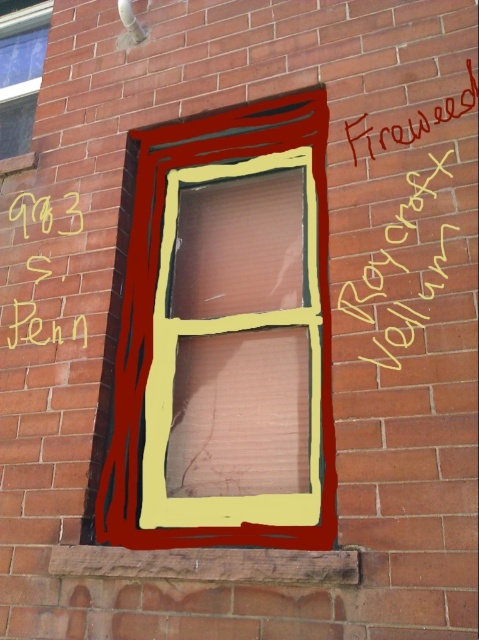
Question: Which object is closer to the camera taking this photo?

Choices:
 (A) yellow marker writing at center right
 (B) wooden window frame at center

Answer: (B)

Question: Is wooden window frame at center above yellow chalk writing at center?

Choices:
 (A) yes
 (B) no

Answer: (B)

Question: Which point is closer to the camera taking this photo?

Choices:
 (A) click(72, 321)
 (B) click(469, 64)
 (C) click(16, 115)

Answer: (B)

Question: Estimate the real-world distances between objects in this image. Which object is closer to the matte glass window at upper left?

Choices:
 (A) wooden window frame at center
 (B) yellow marker writing at center right
 (C) red painted graffiti at upper right

Answer: (A)

Question: Is yellow marker writing at center right above yellow chalk writing at center?

Choices:
 (A) no
 (B) yes

Answer: (B)

Question: Is yellow marker writing at center right thinner than yellow chalk writing at center?

Choices:
 (A) no
 (B) yes

Answer: (B)